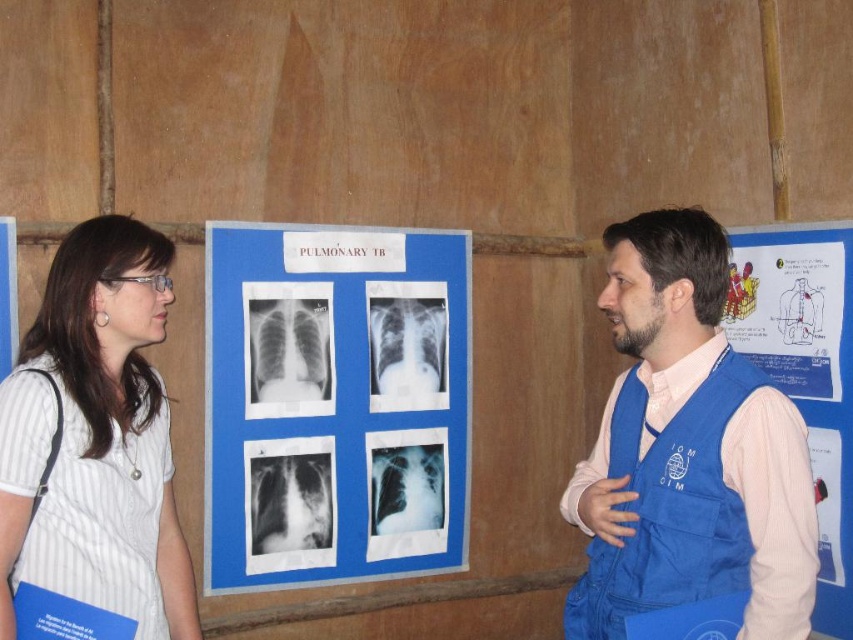
Is blue fabric vest at center further to camera compared to blue fabric poster at center?

No, it is not.

Where is `blue fabric vest at center`? The width and height of the screenshot is (853, 640). blue fabric vest at center is located at coordinates (688, 451).

Does point (308, 461) lie behind point (810, 243)?

Yes, point (308, 461) is behind point (810, 243).

Which is in front, point (335, 387) or point (802, 403)?

Point (802, 403)

Where is `white paper at center`? Image resolution: width=853 pixels, height=640 pixels. white paper at center is located at coordinates (334, 403).

Is the position of blue fabric vest at center less distant than that of white striped shirt at left?

Yes, it is in front of white striped shirt at left.

Locate an element on the screen. blue fabric vest at center is located at coordinates (688, 451).

Identify the location of blue fabric vest at center. (688, 451).